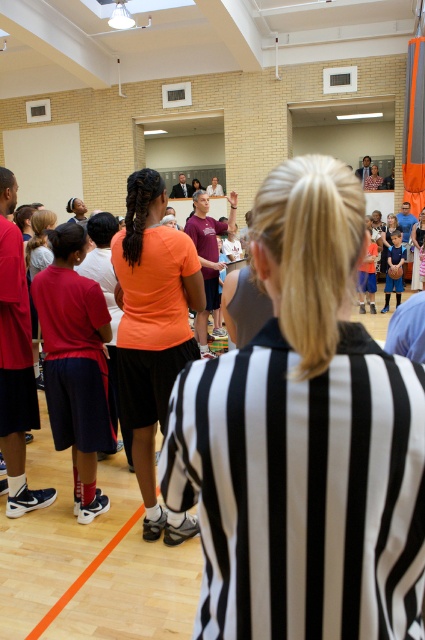
Question: Is orange matte tank top at center wider than orange matte shirt at center?

Choices:
 (A) yes
 (B) no

Answer: (B)

Question: Which object is closer to the camera taking this photo?

Choices:
 (A) orange t-shirt at center
 (B) matte orange shirt at center
 (C) matte black referee shirt at left

Answer: (C)

Question: Which point is closer to the camera?

Choices:
 (A) (65, 349)
 (B) (42, 499)

Answer: (A)

Question: Does matte black referee shirt at left have a larger size compared to orange t-shirt at center?

Choices:
 (A) yes
 (B) no

Answer: (B)

Question: Which point is farther from the camera taking this photo?

Choices:
 (A) [x=195, y=220]
 (B) [x=82, y=417]
 (C) [x=300, y=330]
 (D) [x=379, y=179]

Answer: (D)

Question: Does orange matte tank top at center appear under orange t-shirt at center?

Choices:
 (A) no
 (B) yes

Answer: (B)